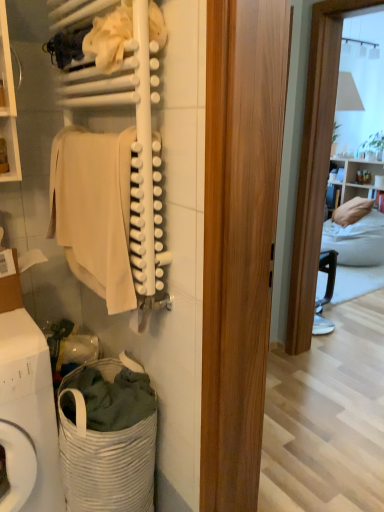
Question: Is white fabric at upper center in front of or behind white woven laundry basket at lower left in the image?

Choices:
 (A) front
 (B) behind

Answer: (A)

Question: Visually, is white fabric at upper center positioned to the left or to the right of white woven laundry basket at lower left?

Choices:
 (A) right
 (B) left

Answer: (A)

Question: Estimate the real-world distances between objects in this image. Which object is closer to the white woven laundry basket at lower left?

Choices:
 (A) beige cotton towel at left
 (B) white woven laundry basket at lower left
 (C) white matte towel at upper left
 (D) white fabric at upper center

Answer: (B)

Question: Estimate the real-world distances between objects in this image. Which object is closer to the white woven laundry basket at lower left?

Choices:
 (A) beige cotton towel at left
 (B) white fabric at upper center
 (C) white matte towel at upper left
 (D) white woven laundry basket at lower left

Answer: (D)